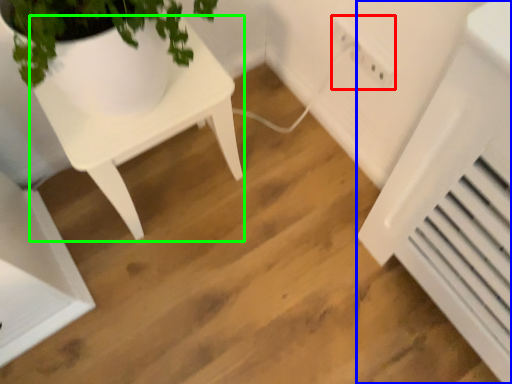
Question: Based on their relative distances, which object is nearer to electric outlet (highlighted by a red box)? Choose from air conditioning (highlighted by a blue box) and table (highlighted by a green box).

Choices:
 (A) air conditioning
 (B) table

Answer: (A)